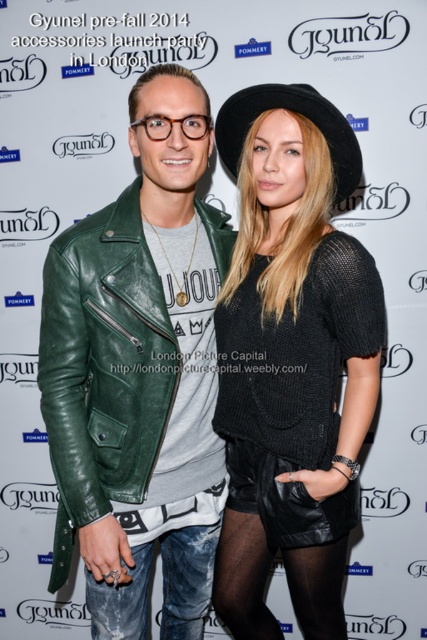
Question: Which of these objects is positioned closest to the black knitted sweater at center?

Choices:
 (A) black felt hat at upper center
 (B) green leather jacket at center
 (C) green leather jacket at left
 (D) denim jeans at lower left

Answer: (B)

Question: Is green leather jacket at left positioned before denim jeans at lower left?

Choices:
 (A) no
 (B) yes

Answer: (B)

Question: Which object appears closest to the camera in this image?

Choices:
 (A) green leather jacket at center
 (B) green leather jacket at left
 (C) denim jeans at lower left

Answer: (A)

Question: Does black knitted sweater at center have a smaller size compared to black felt hat at upper center?

Choices:
 (A) no
 (B) yes

Answer: (A)

Question: Does green leather jacket at center have a greater width compared to black felt hat at upper center?

Choices:
 (A) yes
 (B) no

Answer: (A)

Question: Which of the following is the farthest from the observer?

Choices:
 (A) green leather jacket at left
 (B) denim jeans at lower left

Answer: (B)